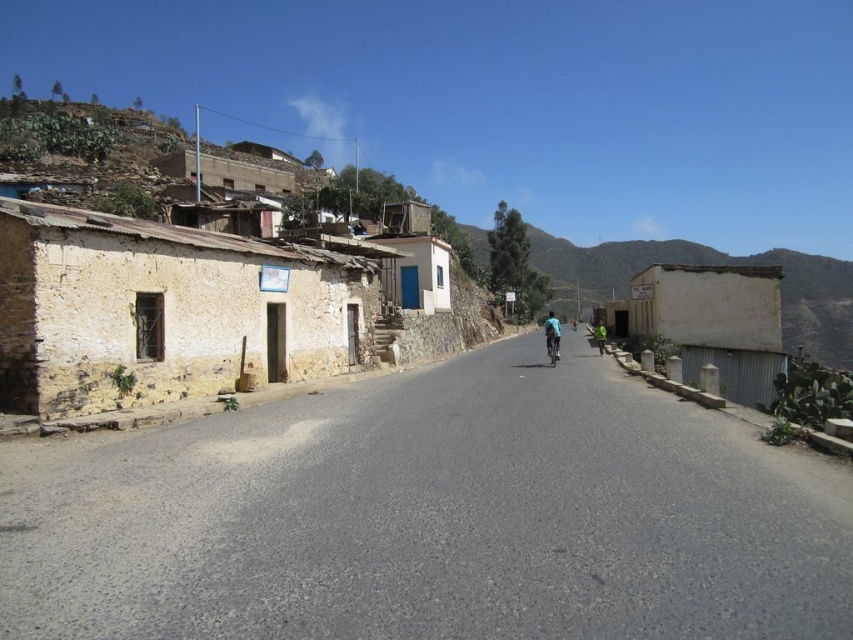
Is blue fabric cyclist at center taller than shiny metallic bicycle at center?

Correct, blue fabric cyclist at center is much taller as shiny metallic bicycle at center.

Does point (547, 320) come closer to viewer compared to point (552, 346)?

That is False.

The width and height of the screenshot is (853, 640). Describe the element at coordinates (552, 333) in the screenshot. I see `blue fabric cyclist at center` at that location.

Image resolution: width=853 pixels, height=640 pixels. Identify the location of blue fabric cyclist at center. (552, 333).

Does blue fabric cyclist at center appear on the right side of green fabric person at center?

No, blue fabric cyclist at center is not to the right of green fabric person at center.

Who is lower down, blue fabric cyclist at center or green fabric person at center?

green fabric person at center

This screenshot has width=853, height=640. In order to click on blue fabric cyclist at center in this screenshot , I will do `click(552, 333)`.

Between yellow stucco wall at left and blue fabric cyclist at center, which one appears on the right side from the viewer's perspective?

Positioned to the right is blue fabric cyclist at center.

Who is positioned more to the left, yellow stucco wall at left or blue fabric cyclist at center?

Positioned to the left is yellow stucco wall at left.

Does point (291, 358) lie behind point (549, 340)?

No.

Identify the location of yellow stucco wall at left. (194, 307).